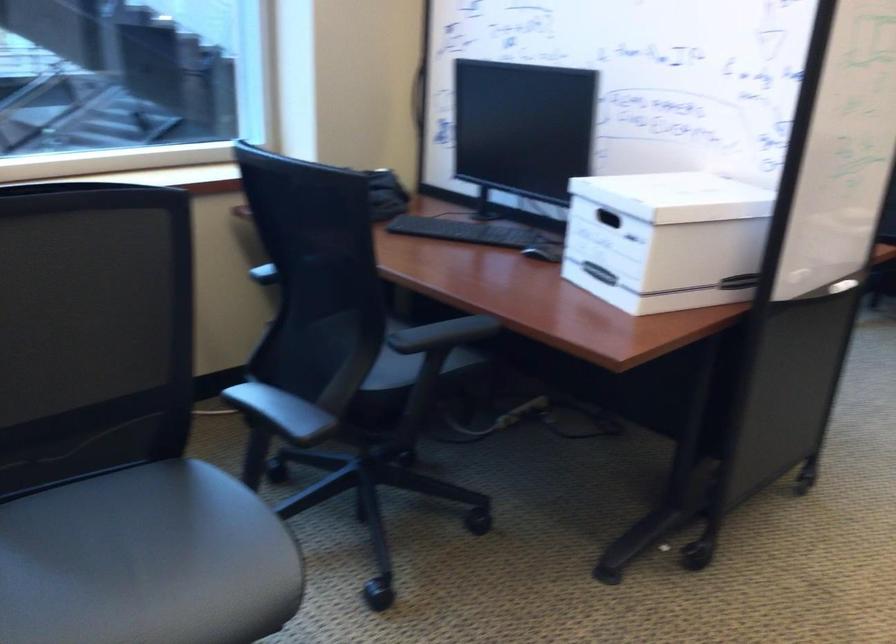
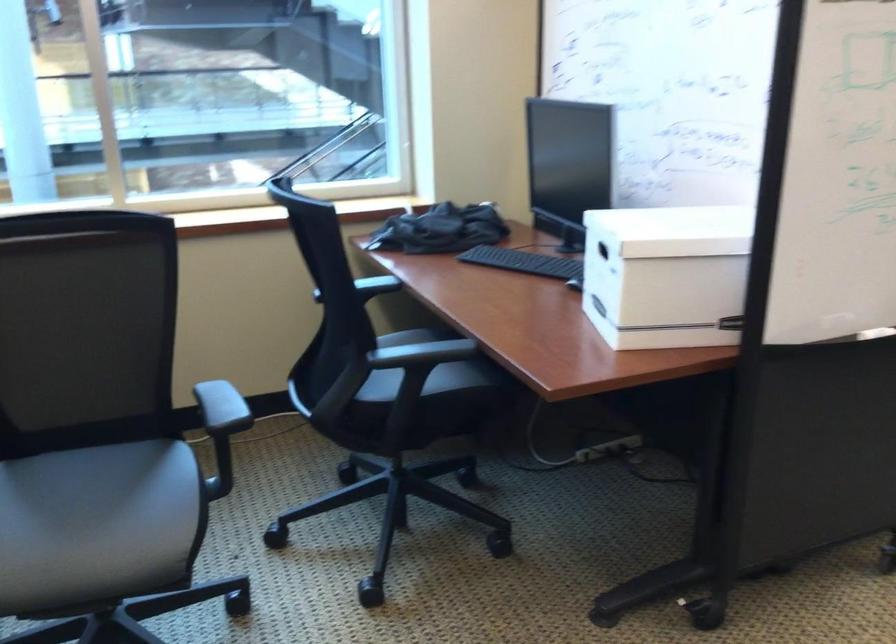
Question: Based on the continuous images, in which direction is the camera rotating? Reply with the corresponding letter.

Choices:
 (A) Left
 (B) Right
 (C) Up
 (D) Down

Answer: (A)